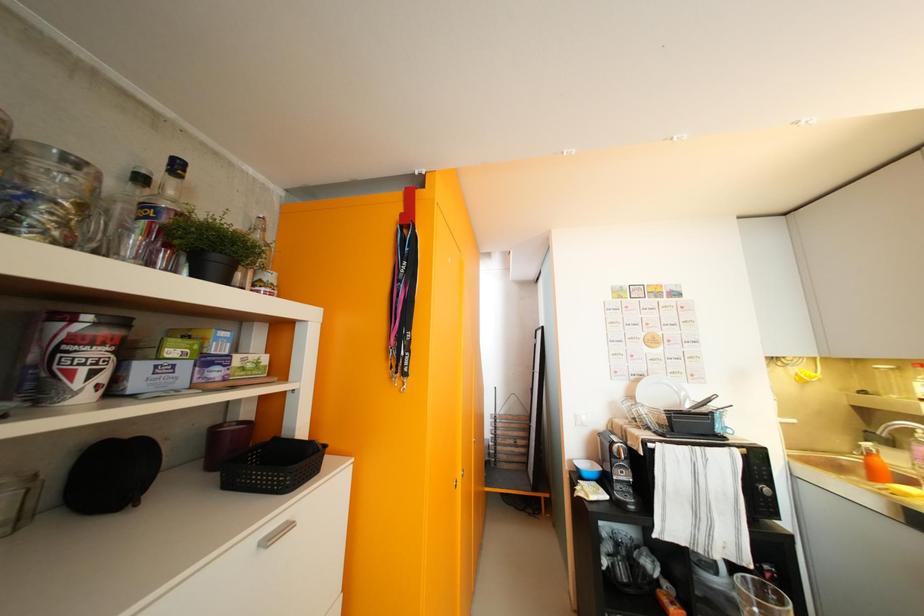
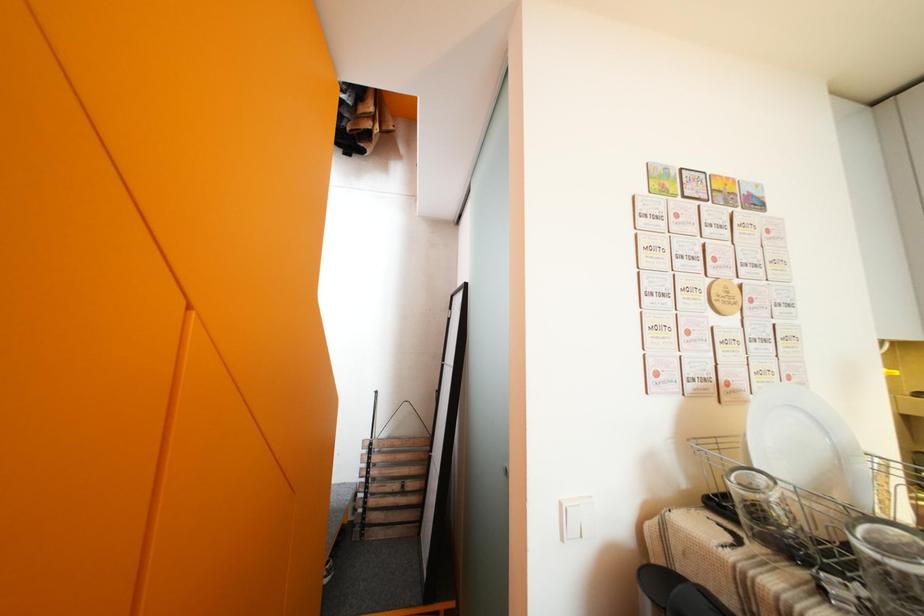
Question: What movement of the cameraman would produce the second image?

Choices:
 (A) Left
 (B) Right
 (C) Forward
 (D) Backward

Answer: (C)